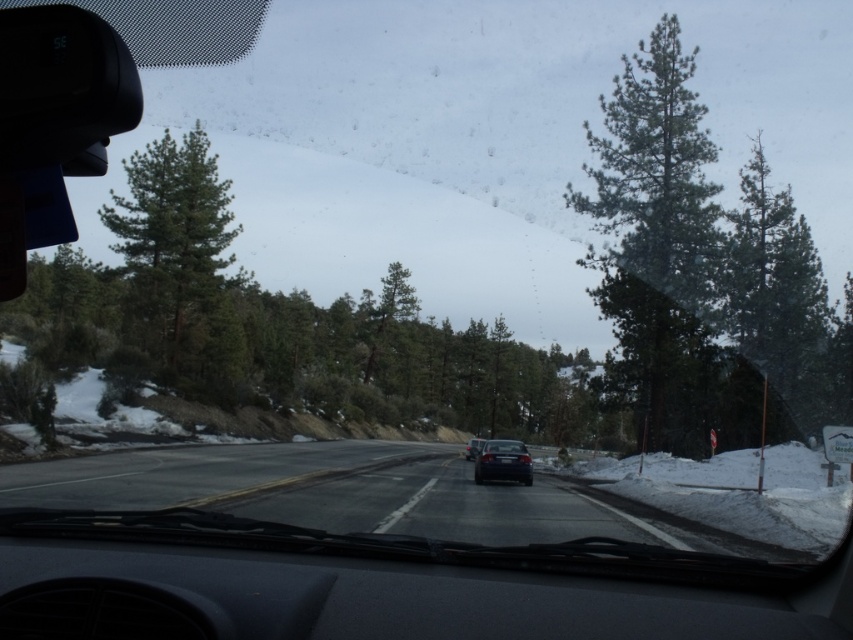
Which is below, black asphalt highway at center or green needle-like tree at right?

Positioned lower is black asphalt highway at center.

Can you confirm if black asphalt highway at center is positioned to the right of green needle-like tree at right?

Incorrect, black asphalt highway at center is not on the right side of green needle-like tree at right.

I want to click on black asphalt highway at center, so click(x=425, y=497).

This screenshot has width=853, height=640. I want to click on black asphalt highway at center, so click(x=425, y=497).

Does green matte tree at left appear on the left side of glossy black car at center?

Indeed, green matte tree at left is positioned on the left side of glossy black car at center.

Can you confirm if green matte tree at left is bigger than glossy black car at center?

Indeed, green matte tree at left has a larger size compared to glossy black car at center.

Find the location of a particular element. The height and width of the screenshot is (640, 853). green matte tree at left is located at coordinates (178, 259).

Between green matte tree at right and glossy black car at center, which one appears on the right side from the viewer's perspective?

green matte tree at right

Does green matte tree at right have a lesser height compared to glossy black car at center?

In fact, green matte tree at right may be taller than glossy black car at center.

Is point (817, 390) closer to viewer compared to point (514, 474)?

No.

Where is `green matte tree at right`? green matte tree at right is located at coordinates (778, 296).